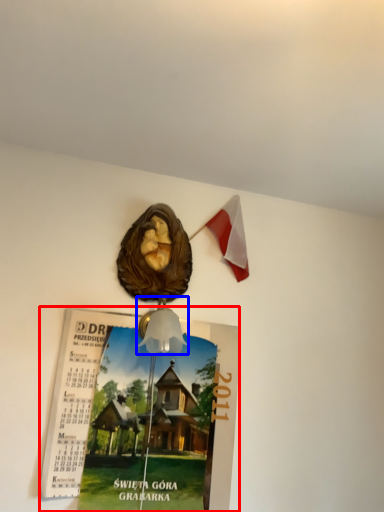
Question: Which of the following is the closest to the observer, poster page (highlighted by a red box) or lamp (highlighted by a blue box)?

Choices:
 (A) poster page
 (B) lamp

Answer: (B)